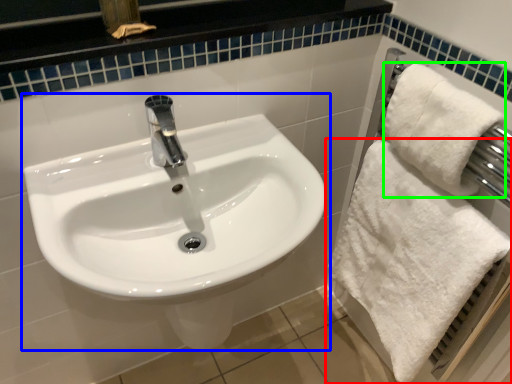
Question: Based on their relative distances, which object is nearer to towel (highlighted by a red box)? Choose from sink (highlighted by a blue box) and bath towel (highlighted by a green box).

Choices:
 (A) sink
 (B) bath towel

Answer: (B)